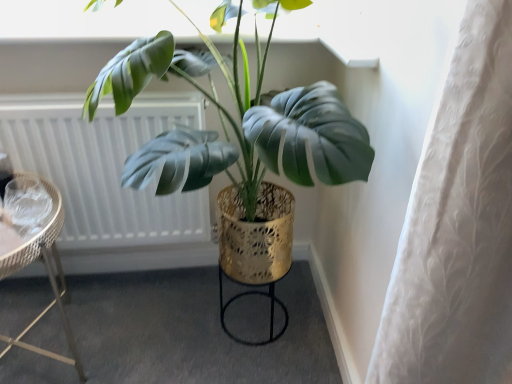
Question: Should I look upward or downward to see white textured radiator at upper left?

Choices:
 (A) down
 (B) up

Answer: (B)

Question: From the image's perspective, is white textured radiator at upper left beneath shiny gold pot at center?

Choices:
 (A) yes
 (B) no

Answer: (A)

Question: Considering the relative sizes of white textured radiator at upper left and shiny gold pot at center in the image provided, is white textured radiator at upper left wider than shiny gold pot at center?

Choices:
 (A) no
 (B) yes

Answer: (A)

Question: Could you tell me if white textured radiator at upper left is facing shiny gold pot at center?

Choices:
 (A) yes
 (B) no

Answer: (A)

Question: From a real-world perspective, is white textured radiator at upper left under shiny gold pot at center?

Choices:
 (A) yes
 (B) no

Answer: (A)

Question: Is white textured radiator at upper left at the left side of shiny gold pot at center?

Choices:
 (A) no
 (B) yes

Answer: (B)

Question: Considering the relative sizes of white textured radiator at upper left and shiny gold pot at center in the image provided, is white textured radiator at upper left smaller than shiny gold pot at center?

Choices:
 (A) no
 (B) yes

Answer: (B)

Question: From the image's perspective, is metallic wicker side table at left located beneath white textured radiator at upper left?

Choices:
 (A) no
 (B) yes

Answer: (B)

Question: From the image's perspective, is metallic wicker side table at left on top of white textured radiator at upper left?

Choices:
 (A) yes
 (B) no

Answer: (B)

Question: Is the position of metallic wicker side table at left less distant than that of white textured radiator at upper left?

Choices:
 (A) yes
 (B) no

Answer: (A)

Question: Does metallic wicker side table at left have a greater width compared to white textured radiator at upper left?

Choices:
 (A) yes
 (B) no

Answer: (A)

Question: From a real-world perspective, does metallic wicker side table at left stand above white textured radiator at upper left?

Choices:
 (A) no
 (B) yes

Answer: (A)

Question: Is metallic wicker side table at left surrounding white textured radiator at upper left?

Choices:
 (A) yes
 (B) no

Answer: (B)

Question: Is shiny gold pot at center positioned with its back to metallic wicker side table at left?

Choices:
 (A) no
 (B) yes

Answer: (A)